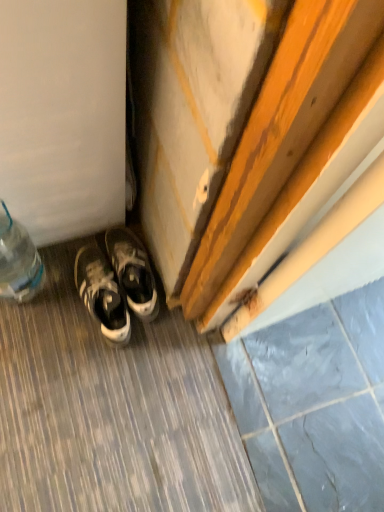
Question: Is clear plastic bottle at lower left not close to white leather sneakers at lower left?

Choices:
 (A) no
 (B) yes

Answer: (A)

Question: Is clear plastic bottle at lower left behind white leather sneakers at lower left?

Choices:
 (A) yes
 (B) no

Answer: (B)

Question: From a real-world perspective, does clear plastic bottle at lower left sit lower than white leather sneakers at lower left?

Choices:
 (A) yes
 (B) no

Answer: (B)

Question: Can you confirm if clear plastic bottle at lower left is bigger than white leather sneakers at lower left?

Choices:
 (A) no
 (B) yes

Answer: (B)

Question: Is clear plastic bottle at lower left facing towards white leather sneakers at lower left?

Choices:
 (A) no
 (B) yes

Answer: (A)

Question: Considering the relative sizes of clear plastic bottle at lower left and white leather sneakers at lower left in the image provided, is clear plastic bottle at lower left smaller than white leather sneakers at lower left?

Choices:
 (A) no
 (B) yes

Answer: (A)

Question: Considering the relative sizes of white leather sneakers at lower left and clear plastic bottle at lower left in the image provided, is white leather sneakers at lower left thinner than clear plastic bottle at lower left?

Choices:
 (A) yes
 (B) no

Answer: (B)

Question: Does white leather sneakers at lower left have a greater width compared to clear plastic bottle at lower left?

Choices:
 (A) no
 (B) yes

Answer: (B)

Question: From a real-world perspective, does white leather sneakers at lower left sit lower than clear plastic bottle at lower left?

Choices:
 (A) no
 (B) yes

Answer: (B)

Question: Is white leather sneakers at lower left bigger than clear plastic bottle at lower left?

Choices:
 (A) no
 (B) yes

Answer: (A)

Question: Could you tell me if white leather sneakers at lower left is facing clear plastic bottle at lower left?

Choices:
 (A) yes
 (B) no

Answer: (B)

Question: Is white leather sneakers at lower left positioned in front of clear plastic bottle at lower left?

Choices:
 (A) no
 (B) yes

Answer: (A)

Question: Is gray stone tile at lower right beside white leather sneakers at lower left?

Choices:
 (A) yes
 (B) no

Answer: (B)